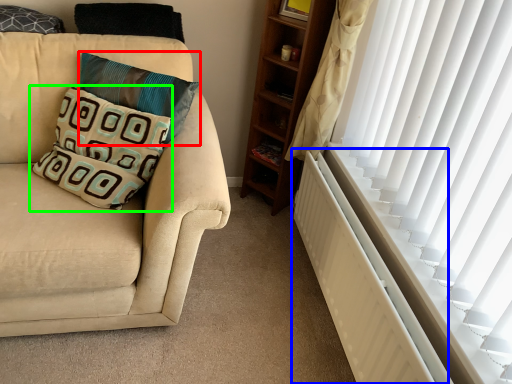
Question: Which is farther away from pillow (highlighted by a red box)? radiator (highlighted by a blue box) or pillow (highlighted by a green box)?

Choices:
 (A) radiator
 (B) pillow

Answer: (A)